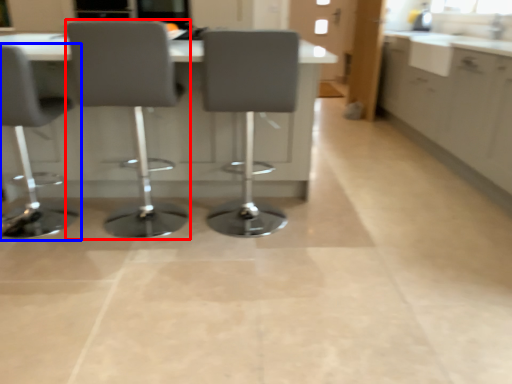
Question: Which object appears farthest to the camera in this image, chair (highlighted by a red box) or chair (highlighted by a blue box)?

Choices:
 (A) chair
 (B) chair

Answer: (B)